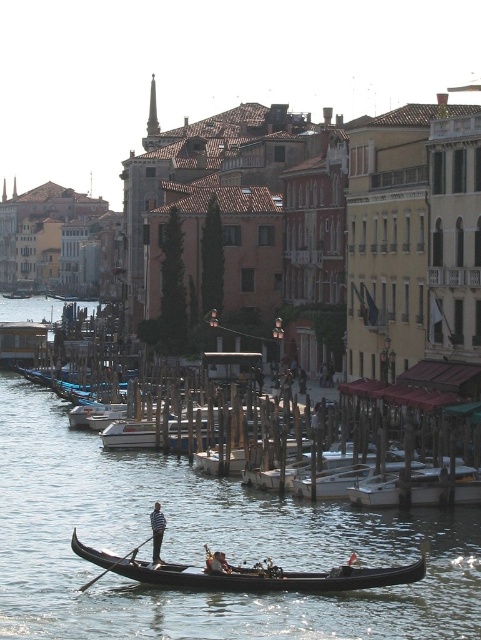
You are a tourist standing on the canal bridge and see the dark brown leather oarsman at center and the black wood paddle at lower center in the water. Which object is taller?

The dark brown leather oarsman at center is taller than the black wood paddle at lower center.

Based on the photo, you are standing on the wooden docked boats at center. Looking towards the direction of the gondola, which direction should you turn to face the wooden posts in the midground?

The wooden docked boats at center are located at point (202, 544). Since the gondola is in the foreground and the wooden posts are in the midground, turning towards the midground direction would align you with the wooden posts.

You are standing on the canal bank and see the dark brown leather oarsman at center and the black wood paddle at lower center. Which object is closer to your right side?

The dark brown leather oarsman at center is positioned on the right side of black wood paddle at lower center, so the dark brown leather oarsman at center is closer to your right side.